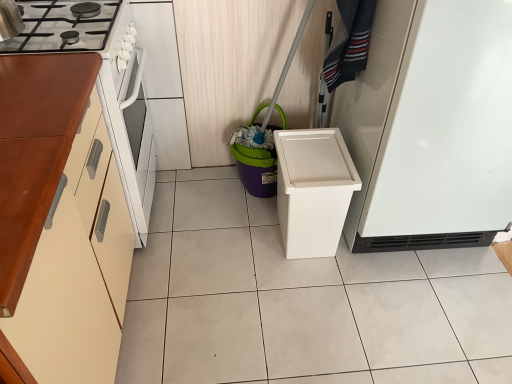
The image size is (512, 384). I want to click on free space on the front side of purple plastic bucket at center, so [239, 225].